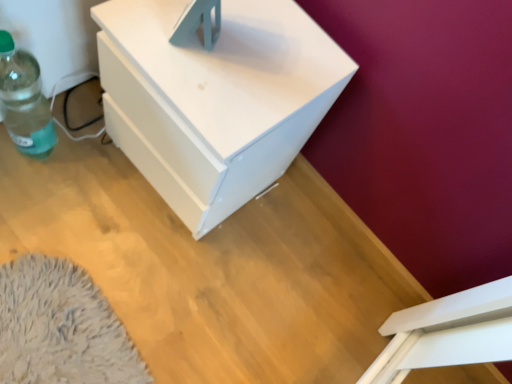
I want to click on free space above white matte nightstand at center (from a real-world perspective), so click(241, 55).